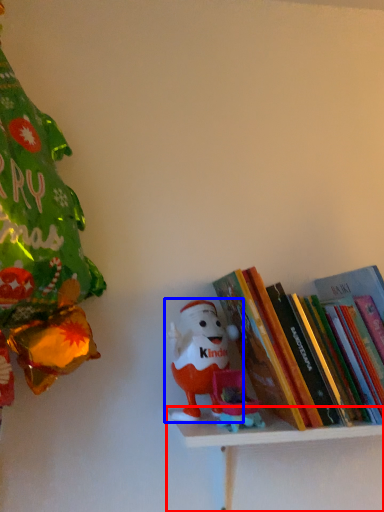
Question: Among these objects, which one is farthest to the camera, shelf (highlighted by a red box) or toy (highlighted by a blue box)?

Choices:
 (A) shelf
 (B) toy

Answer: (B)